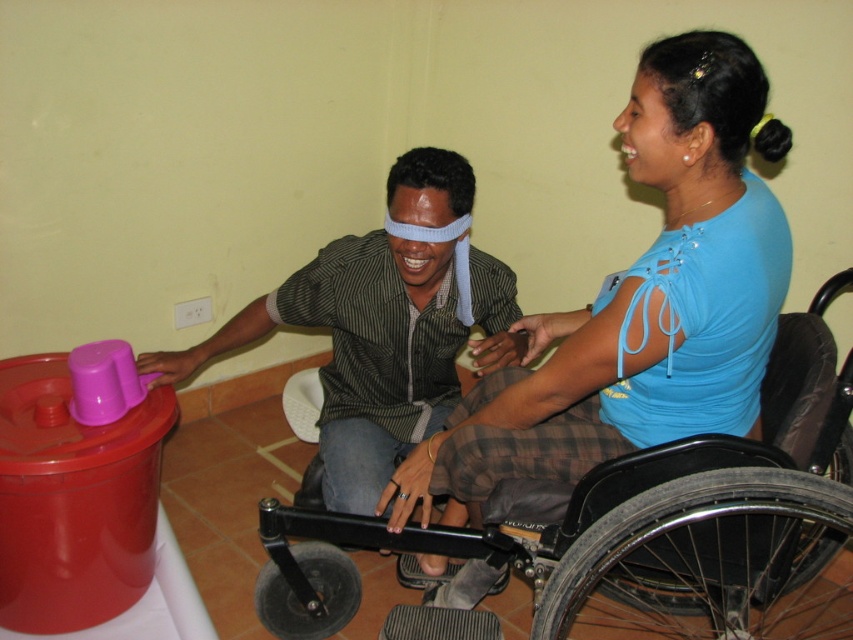
Can you confirm if blue cotton shirt at center is positioned above black plastic wheelchair at center?

Indeed, blue cotton shirt at center is positioned over black plastic wheelchair at center.

Between blue cotton shirt at center and black plastic wheelchair at center, which one has more height?

With more height is blue cotton shirt at center.

Describe the element at coordinates (641, 300) in the screenshot. I see `blue cotton shirt at center` at that location.

This screenshot has height=640, width=853. What are the coordinates of `blue cotton shirt at center` in the screenshot? It's located at [641, 300].

Does blue cotton shirt at center have a greater width compared to matte black shirt at center?

In fact, blue cotton shirt at center might be narrower than matte black shirt at center.

The image size is (853, 640). What do you see at coordinates (641, 300) in the screenshot? I see `blue cotton shirt at center` at bounding box center [641, 300].

At what (x,y) coordinates should I click in order to perform the action: click on blue cotton shirt at center. Please return your answer as a coordinate pair (x, y). The height and width of the screenshot is (640, 853). Looking at the image, I should click on (641, 300).

Can you confirm if black plastic wheelchair at center is bigger than smooth skin forehead at center?

Yes, black plastic wheelchair at center is bigger than smooth skin forehead at center.

Between point (312, 596) and point (404, 220), which one is positioned behind?

Point (312, 596)

This screenshot has height=640, width=853. I want to click on black plastic wheelchair at center, so 625,524.